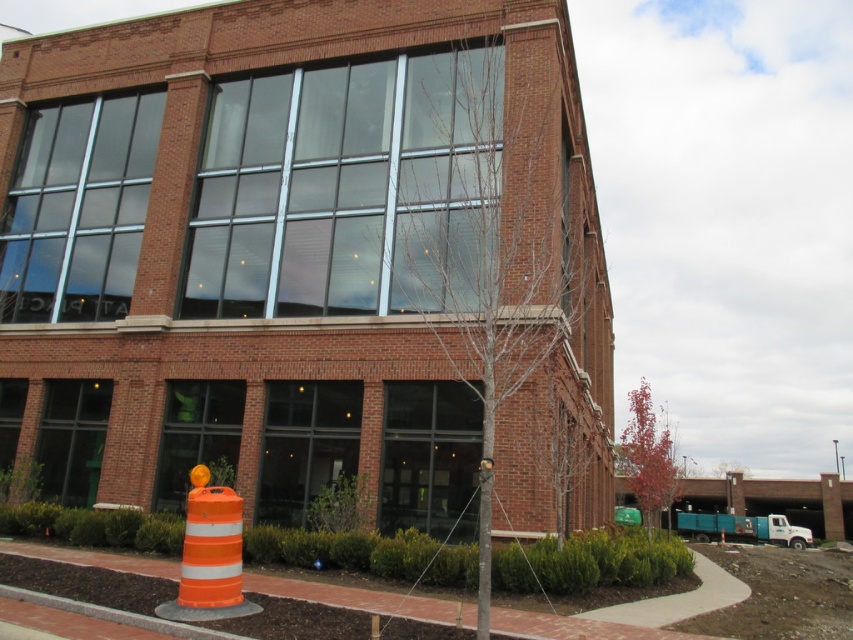
In the scene shown: Which is more to the left, orange reflective cone at lower left or orange reflective cone at center?

Positioned to the left is orange reflective cone at lower left.

Which is more to the right, orange reflective cone at lower left or orange reflective cone at center?

orange reflective cone at center

Between point (233, 534) and point (722, 529), which one is positioned in front?

Point (233, 534) is in front.

Where is `orange reflective cone at lower left`? This screenshot has height=640, width=853. orange reflective cone at lower left is located at coordinates (209, 556).